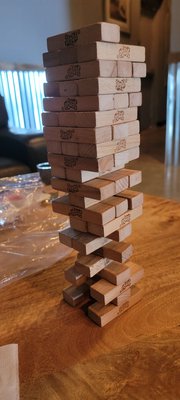
The height and width of the screenshot is (400, 180). Identify the location of wooden jenga block. (95, 264), (121, 272), (55, 394), (60, 388).